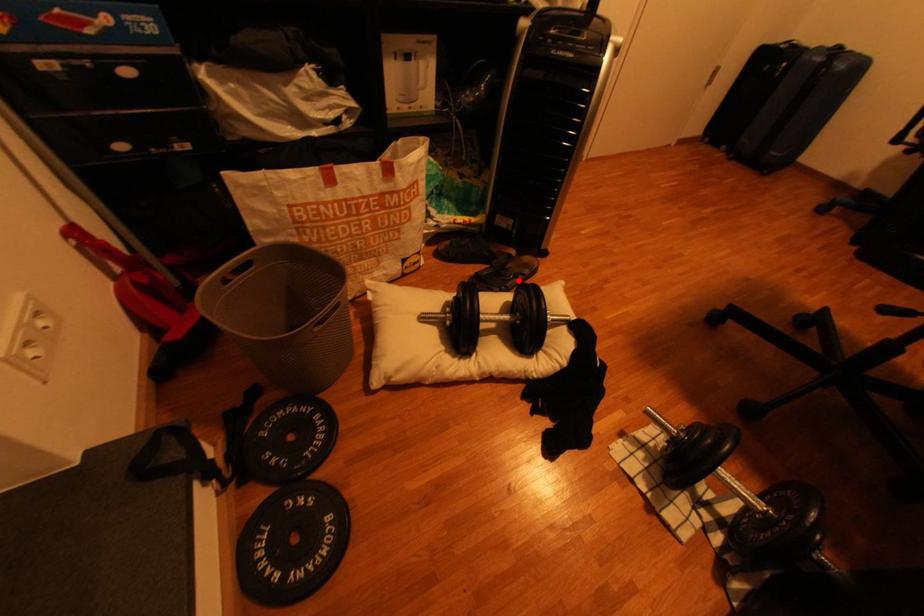
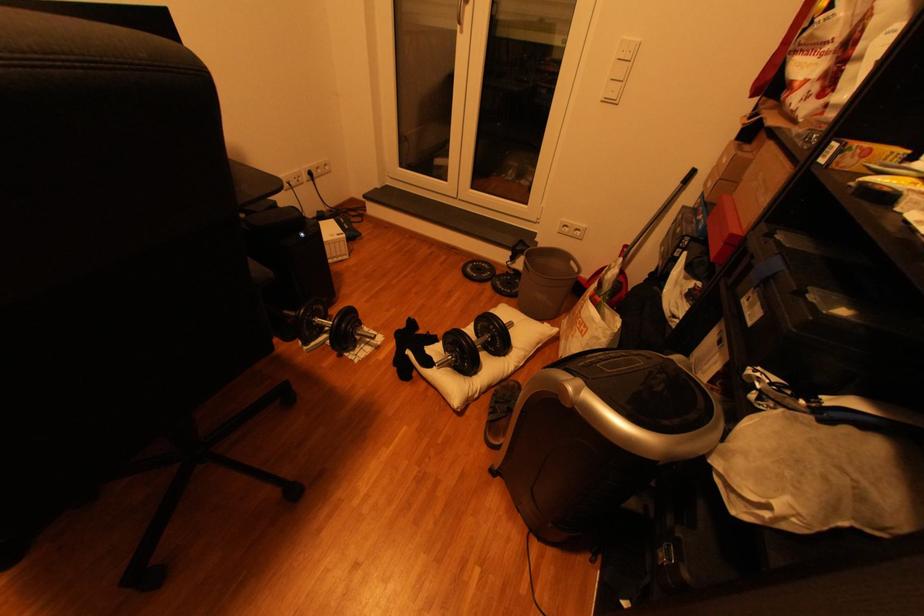
Where in the second image is the point corresponding to the highlighted location from the first image?

(505, 402)